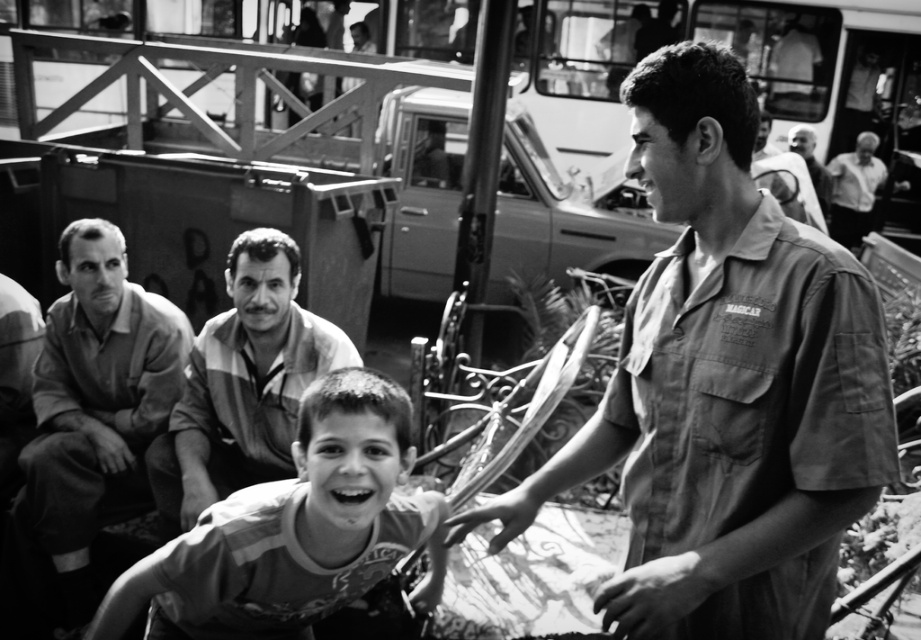
Question: Where is striped fabric shirt at lower center located in relation to striped fabric shirt at center in the image?

Choices:
 (A) left
 (B) right

Answer: (B)

Question: Is smooth fabric shirt at center bigger than white cotton shirt at upper right?

Choices:
 (A) no
 (B) yes

Answer: (A)

Question: Which of the following is the farthest from the observer?

Choices:
 (A) (732, 214)
 (B) (266, 570)
 (C) (814, 132)
 (D) (193, 518)

Answer: (C)

Question: Can you confirm if striped fabric shirt at lower center is positioned above smooth fabric shirt at left?

Choices:
 (A) yes
 (B) no

Answer: (B)

Question: Which object appears farthest from the camera in this image?

Choices:
 (A) smooth fabric shirt at left
 (B) smooth fabric shirt at center
 (C) striped fabric shirt at center
 (D) smooth skin face at upper right

Answer: (D)

Question: Among these points, which one is farthest from the camera?

Choices:
 (A) (223, 524)
 (B) (356, 356)

Answer: (B)